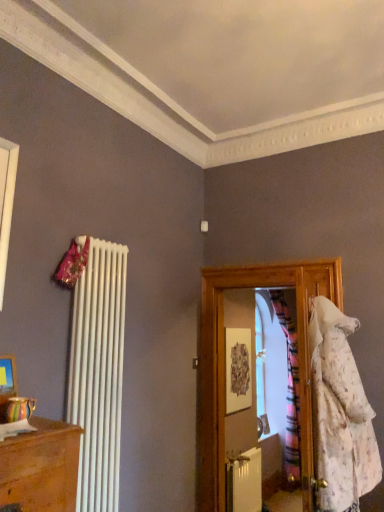
Where is `white matte radiator at lower left`? This screenshot has width=384, height=512. white matte radiator at lower left is located at coordinates (244, 482).

Describe the element at coordinates (244, 482) in the screenshot. I see `white matte radiator at lower left` at that location.

Measure the distance between point (x=244, y=511) and camera.

Point (x=244, y=511) is 3.81 meters from camera.

I want to click on white matte radiator at lower left, so click(244, 482).